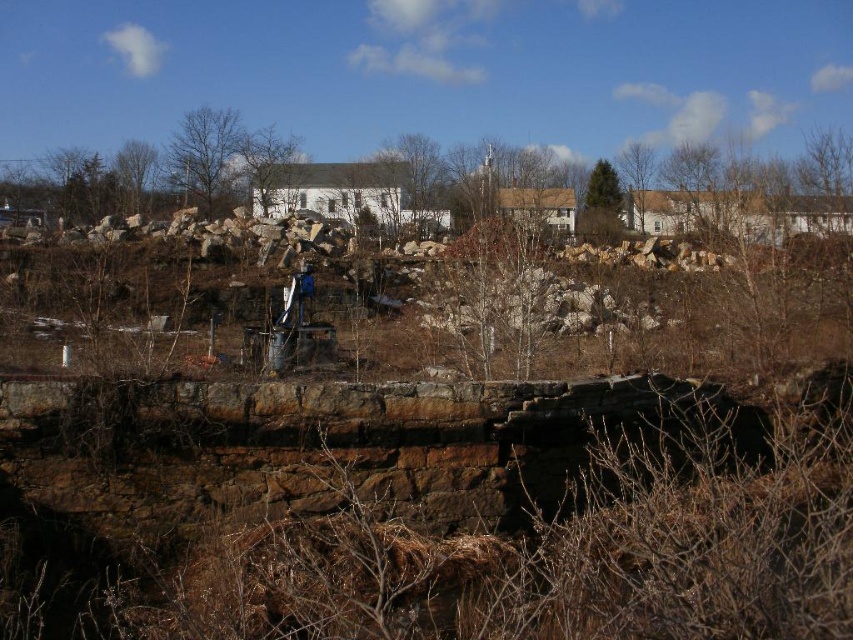
Question: Is brown leafless tree at upper left positioned before green textured tree at upper center?

Choices:
 (A) no
 (B) yes

Answer: (B)

Question: Which object is closer to the camera taking this photo?

Choices:
 (A) brown leafless tree at center
 (B) brown leafless tree at upper right
 (C) green textured tree at upper center

Answer: (B)

Question: Considering the real-world distances, which object is closest to the brown leafless tree at upper right?

Choices:
 (A) brown leafless tree at upper left
 (B) bare branches at upper left

Answer: (B)

Question: Does brown leafless tree at center appear over brown leafless tree at upper left?

Choices:
 (A) yes
 (B) no

Answer: (A)

Question: Does brown leafless tree at center have a smaller size compared to brown leafless tree at upper left?

Choices:
 (A) no
 (B) yes

Answer: (B)

Question: Which of the following is the closest to the observer?

Choices:
 (A) (239, 141)
 (B) (642, 163)

Answer: (A)